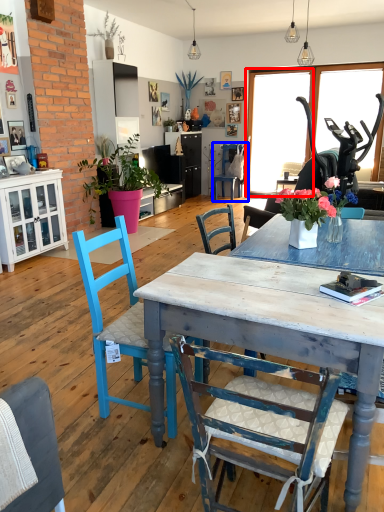
Question: Which point is further to the camera, window screen (highlighted by a red box) or chair (highlighted by a blue box)?

Choices:
 (A) window screen
 (B) chair

Answer: (B)